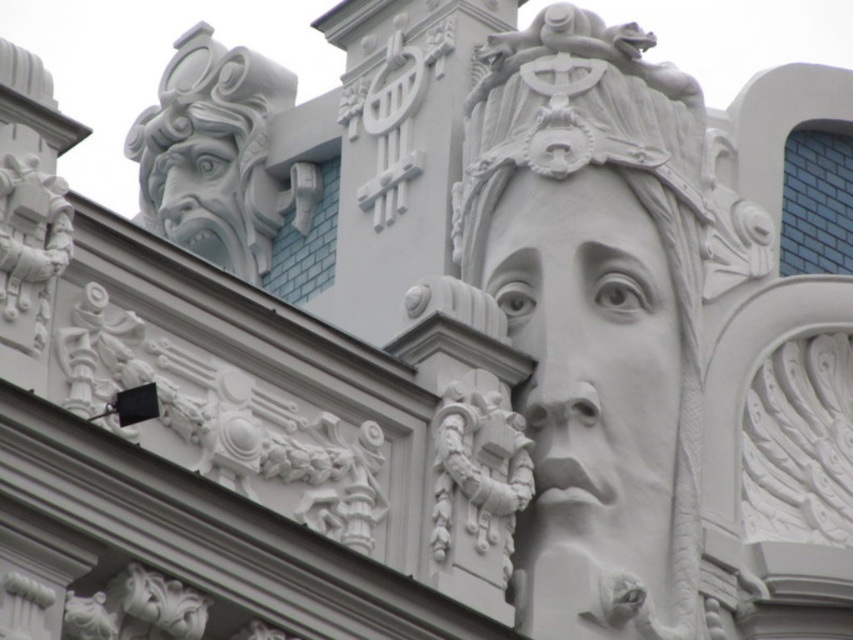
You are an art conservator examining the facade. You notice the white stone sculpture at upper center and the white stone face at center. Which one is closer to you as you face the facade?

The white stone sculpture at upper center is closer to you because it is positioned in front of the white stone face at center.

You are an architect examining the building facade. You need to determine which of the two sculptures, the white stone face at center or the white stone gargoyle at upper left, is narrower in width. Which one is narrower?

The white stone face at center has a lesser width compared to the white stone gargoyle at upper left, so the white stone face at center is narrower in width.

You are an art restorer examining the building facade. You need to clean the white stone sculpture at upper center and the white stone face at center. Which one is positioned to the right of the other?

The white stone sculpture at upper center is to the right of the white stone face at center, so the white stone sculpture at upper center is positioned to the right of the white stone face at center.